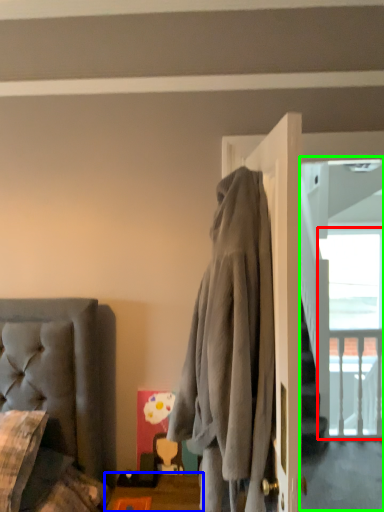
Question: Based on their relative distances, which object is nearer to window (highlighted by a red box)? Choose from table (highlighted by a blue box) and screen door (highlighted by a green box).

Choices:
 (A) table
 (B) screen door

Answer: (B)